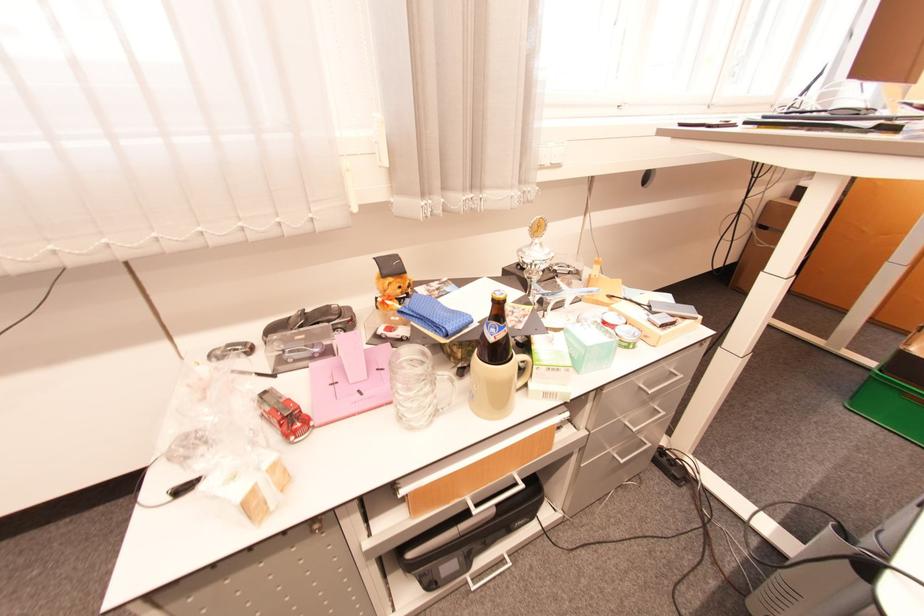
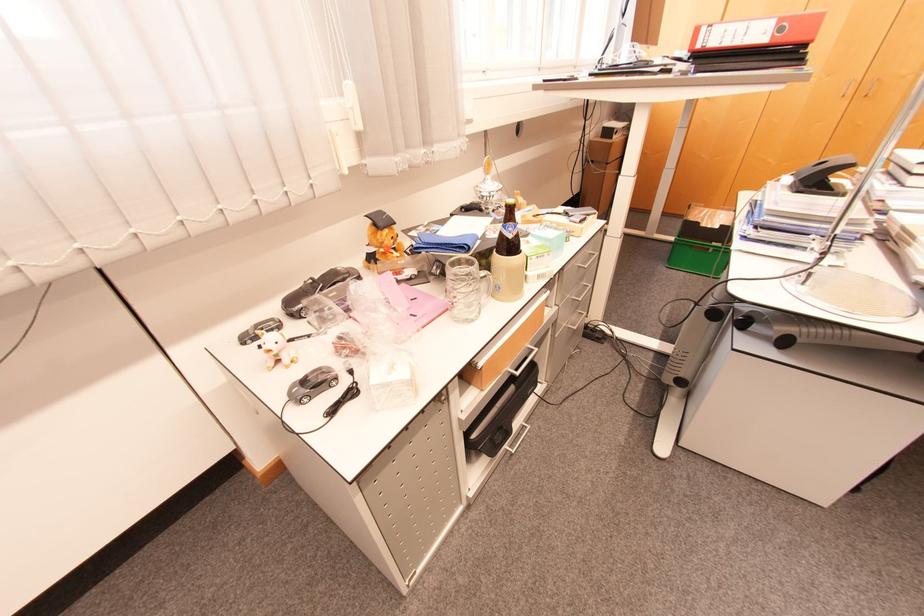
Question: The first image is from the beginning of the video and the second image is from the end. How did the camera likely rotate when shooting the video?

Choices:
 (A) Left
 (B) Right
 (C) Up
 (D) Down

Answer: (B)